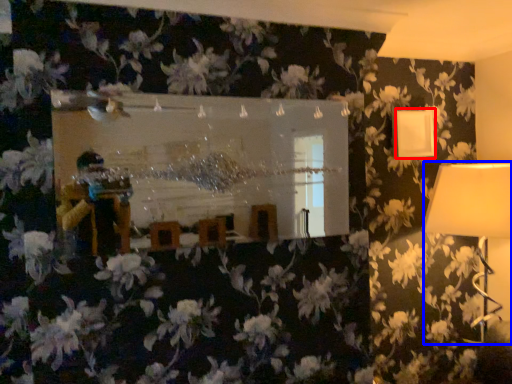
Question: Which object is closer to the camera taking this photo, lamp (highlighted by a red box) or lamp (highlighted by a blue box)?

Choices:
 (A) lamp
 (B) lamp

Answer: (B)